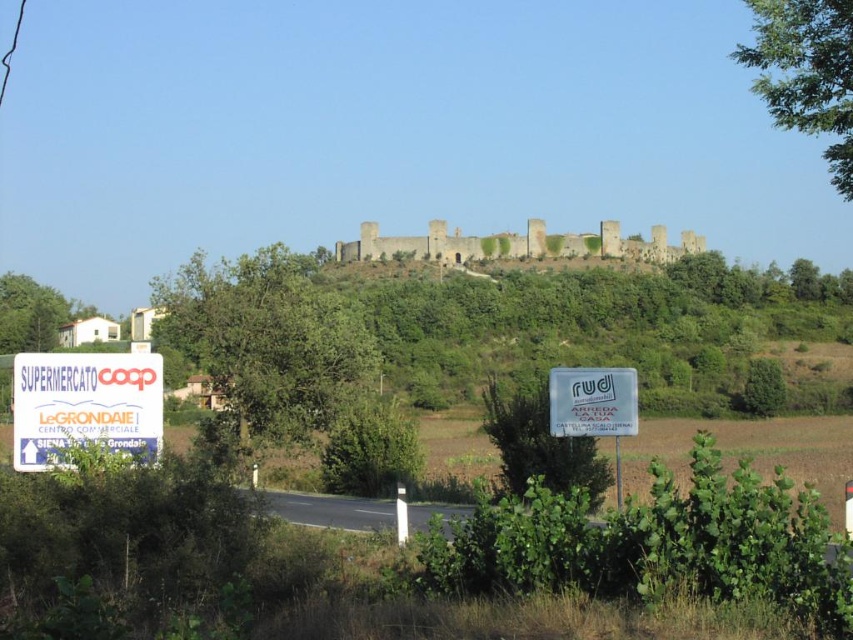
Question: Is white plastic sign at lower left above stone wall at upper center?

Choices:
 (A) no
 (B) yes

Answer: (A)

Question: Can you confirm if white plastic sign at lower left is positioned above stone wall at upper center?

Choices:
 (A) yes
 (B) no

Answer: (B)

Question: Which object is farther from the camera taking this photo?

Choices:
 (A) white plastic sign at lower left
 (B) stone wall at upper center
 (C) white plastic sign at center-right

Answer: (B)

Question: Which object is positioned closest to the white plastic sign at lower left?

Choices:
 (A) white plastic sign at center-right
 (B) stone wall at upper center

Answer: (A)

Question: Which object is closer to the camera taking this photo?

Choices:
 (A) white plastic sign at center-right
 (B) white plastic sign at lower left

Answer: (B)

Question: Is the position of stone wall at upper center less distant than that of white plastic sign at center-right?

Choices:
 (A) yes
 (B) no

Answer: (B)